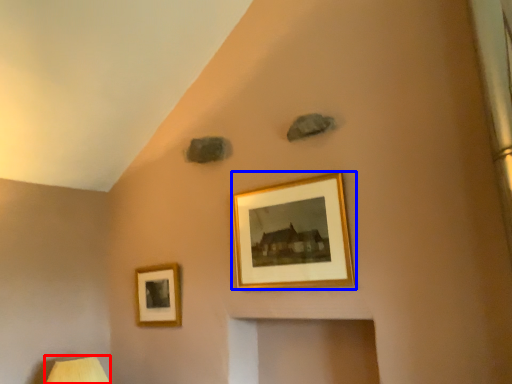
Question: Which object is further to the camera taking this photo, table lamp (highlighted by a red box) or picture frame (highlighted by a blue box)?

Choices:
 (A) table lamp
 (B) picture frame

Answer: (A)